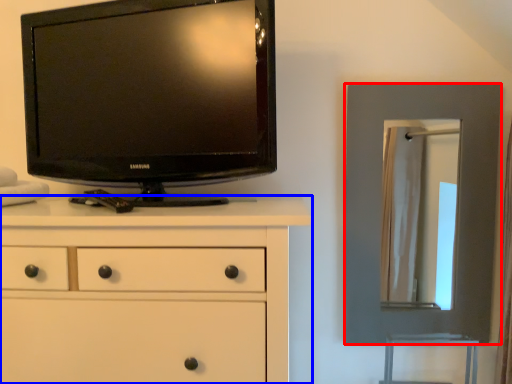
Question: Which object is closer to the camera taking this photo, picture frame (highlighted by a red box) or chest of drawers (highlighted by a blue box)?

Choices:
 (A) picture frame
 (B) chest of drawers

Answer: (B)